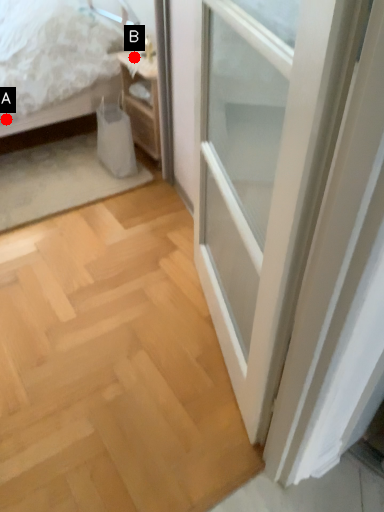
Question: Two points are circled on the image, labeled by A and B beside each circle. Among these points, which one is nearest to the camera?

Choices:
 (A) A is closer
 (B) B is closer

Answer: (A)